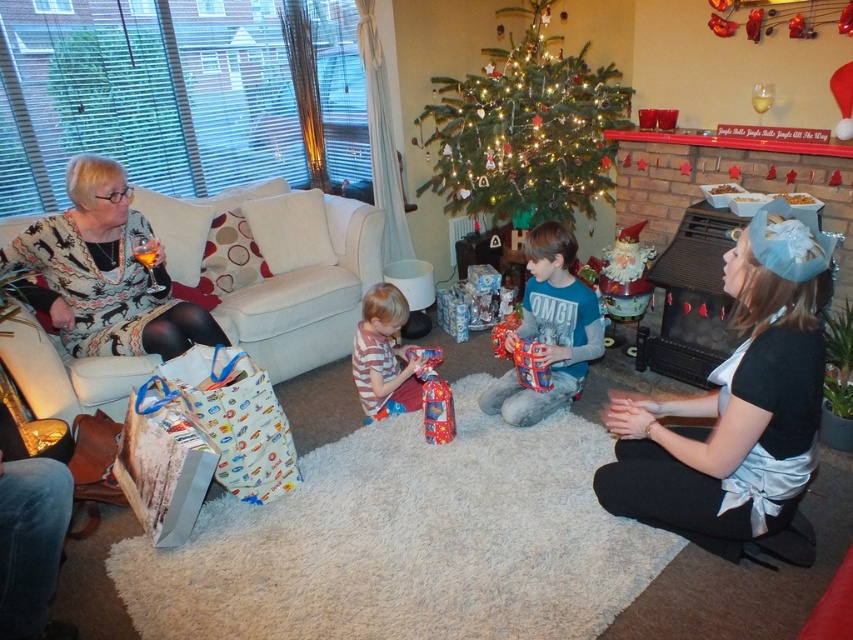
You are a guest at the festive gathering and you want to take a photo of both the patterned sweater at left and the striped fabric shirt at center. Which one should you focus on first if you want to capture both in the same frame without moving your camera?

You should focus on the striped fabric shirt at center first because the patterned sweater at left is located above it, so adjusting the camera to include both would require ensuring the upper and lower positions are within the frame.

You are a delivery robot with a width of 1.2 meters. You are in the living room and need to move from the patterned sweater at left to the blue cotton shirt at center. Is there enough space for you to pass through the area between them?

A: The distance between the patterned sweater at left and the blue cotton shirt at center is 1.53 meters. Since the robot is 1.2 meters wide, there is sufficient space for it to pass through the area between them.

Looking at this image, you are a guest at this festive gathering and want to know which clothing item is taller between the silky silver dress at lower right and the patterned sweater at left. Can you tell me?

The silky silver dress at lower right is taller than the patterned sweater at left.